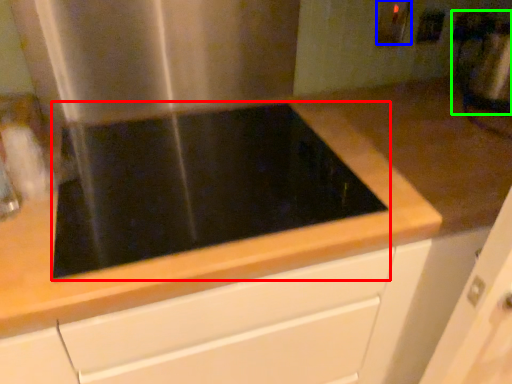
Question: Which is nearer to the gas stove (highlighted by a red box)? electric outlet (highlighted by a blue box) or blender (highlighted by a green box).

Choices:
 (A) electric outlet
 (B) blender

Answer: (A)